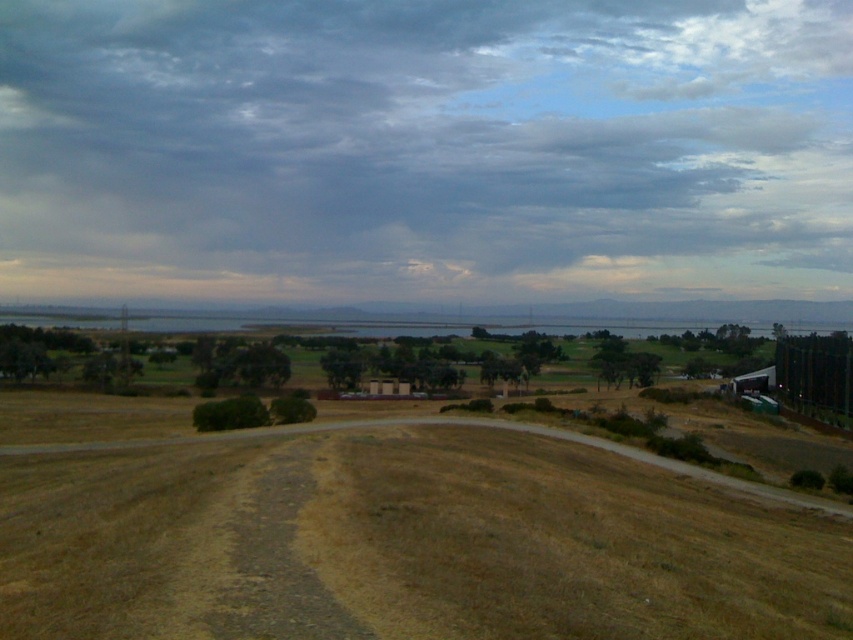
You are standing in the middle of the field and want to take a photo of the cloudy sky at upper center and the brown dry grass at lower center. Which object is located to the right of the other?

The cloudy sky at upper center is positioned on the right side of brown dry grass at lower center.

You are a drone operator planning to fly a drone with a 1.2 meter wingspan. Looking at the image, will the cloudy sky at upper center provide enough space for the drone to fly without hitting the smooth asphalt road at center?

The cloudy sky at upper center might be wider than smooth asphalt road at center, so there is likely enough space for the drone with a 1.2 meter wingspan to fly safely without hitting the road.

You are a drone operator planning to fly a drone from the cloudy sky at upper center to the smooth asphalt road at center. According to the scene description, which direction should you direct the drone to move?

The cloudy sky at upper center is above the smooth asphalt road at center, so the drone should move downward to reach the road.